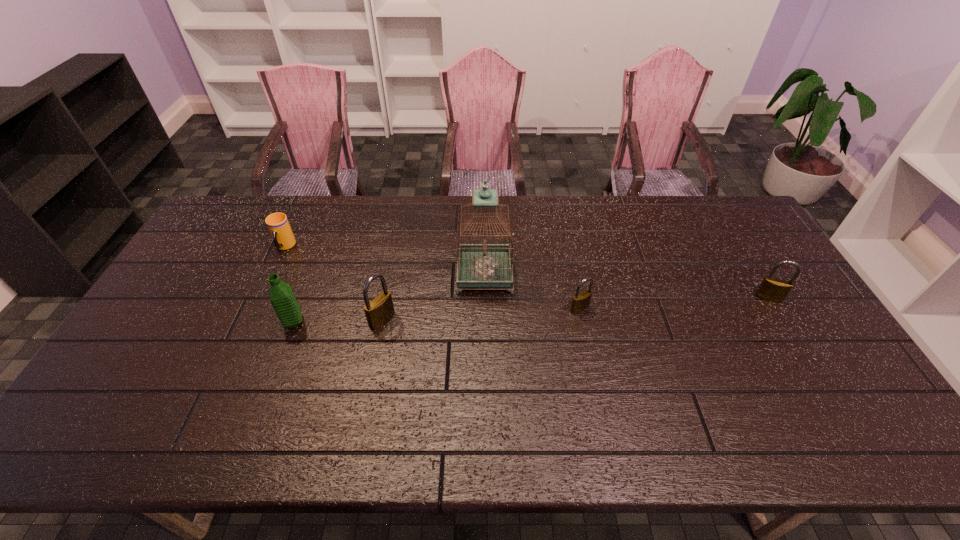
Where is `the third object from left to right`? The width and height of the screenshot is (960, 540). the third object from left to right is located at coordinates (378, 311).

At what (x,y) coordinates should I click in order to perform the action: click on the second padlock from right to left. Please return your answer as a coordinate pair (x, y). Image resolution: width=960 pixels, height=540 pixels. Looking at the image, I should click on (580, 301).

Locate an element on the screen. the fifth object from left to right is located at coordinates (580, 301).

Identify the location of the second shortest padlock. Image resolution: width=960 pixels, height=540 pixels. (772, 289).

Where is `the third shortest object`? Image resolution: width=960 pixels, height=540 pixels. the third shortest object is located at coordinates (772, 289).

At what (x,y) coordinates should I click in order to perform the action: click on the tallest object. Please return your answer as a coordinate pair (x, y). Image resolution: width=960 pixels, height=540 pixels. Looking at the image, I should click on (484, 265).

Locate an element on the screen. The width and height of the screenshot is (960, 540). birdcage is located at coordinates (484, 265).

The height and width of the screenshot is (540, 960). What are the coordinates of `the leftmost object` in the screenshot? It's located at (277, 223).

Find the location of a particular element. water bottle is located at coordinates pos(281,296).

Where is `vacant area situated 0.310m on the right of the leftmost padlock`? This screenshot has height=540, width=960. vacant area situated 0.310m on the right of the leftmost padlock is located at coordinates (502, 320).